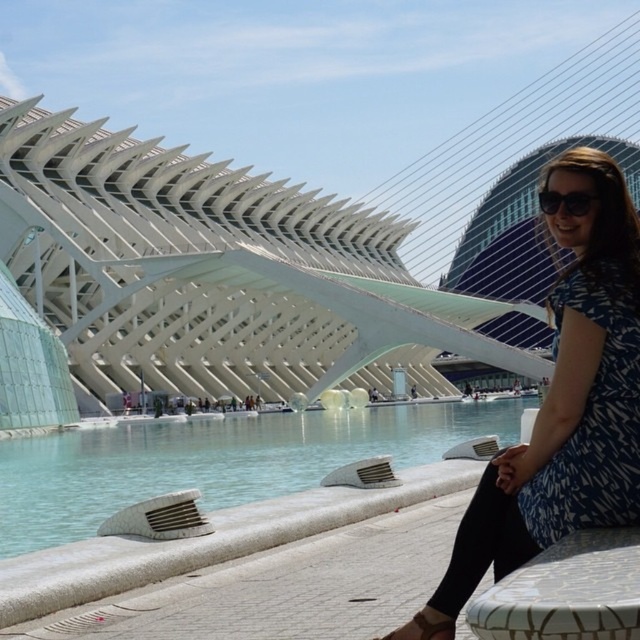
You are standing at the City of Arts and Sciences in Valencia, Spain. You see a white textured ledge at lower center and a brown leather sandal at lower center. Which object is located to the left when viewed from your perspective?

The white textured ledge at lower center is positioned on the left side of the brown leather sandal at lower center, so it is located to the left when viewed from your perspective.

You are standing at the City of Arts and Sciences in Valencia, Spain, and you see two points marked in the image. The first point is at coordinates point (637, 413) and the second point is at point (433, 632). Which of these points is closer to you?

Point (637, 413) is closer to you because it is further to the viewer than point (433, 632).

You are a photographer taking a picture of the woman in the scene. You notice the blue printed dress at lower right and the brown leather sandal at lower center. Which object is covering part of the other?

The blue printed dress at lower right is positioned over brown leather sandal at lower center, so the dress is covering part of the sandal.